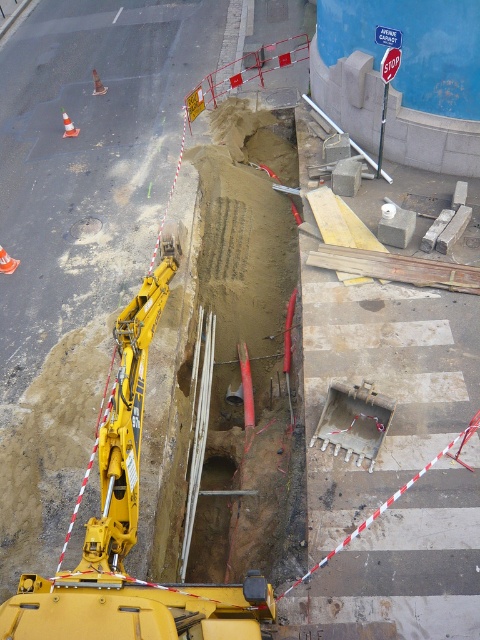
You are a construction worker standing at the edge of the trench. You need to operate the yellow metallic excavator at center to move some debris. However, there is a smooth concrete hole at center above it. Is there a risk of the excavator getting too close to the hole?

The yellow metallic excavator at center is positioned under the smooth concrete hole at center, so there is a risk of the excavator getting too close to the hole if not careful.

You are a construction worker who needs to determine if the yellow metallic excavator at center can fit into the smooth concrete hole at center without any modifications. Based on their sizes, what would you advise?

The yellow metallic excavator at center is bigger than the smooth concrete hole at center, so it cannot fit into the hole without modifications.

You are standing at the edge of the trench and want to place two markers at the coordinates point (141, 304) and point (75, 234). Which marker will be closer to you when viewed from your current position?

Point (141, 304) is closer to the viewer than point (75, 234), so the marker at point (141, 304) will be closer to you.